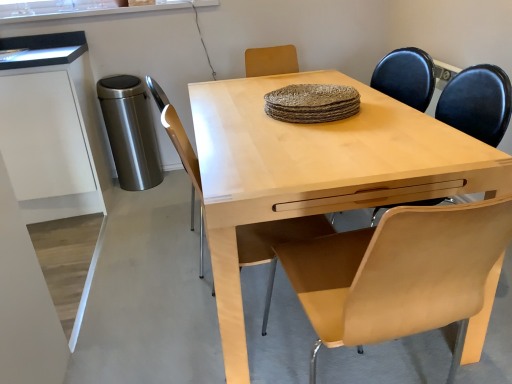
This screenshot has width=512, height=384. What do you see at coordinates (276, 236) in the screenshot? I see `light brown leather chair at center` at bounding box center [276, 236].

The image size is (512, 384). What do you see at coordinates (317, 171) in the screenshot?
I see `light wood desk at center` at bounding box center [317, 171].

Locate an element on the screen. This screenshot has height=384, width=512. light wood desk at center is located at coordinates (317, 171).

You are a GUI agent. You are given a task and a screenshot of the screen. Output one action in this format:
    pyautogui.click(x=<x>, y=<y>)
    Task: Click on the white matte cabinet at left
    The width and height of the screenshot is (512, 384).
    Given the screenshot: What is the action you would take?
    pyautogui.click(x=52, y=128)

Where is `light brown leather chair at center`? The width and height of the screenshot is (512, 384). light brown leather chair at center is located at coordinates (276, 236).

In the scene shown: What's the angular difference between light brown leather chair at center and light wood desk at center's facing directions?

There is a 180-degree angle between the facing directions of light brown leather chair at center and light wood desk at center.

In the scene shown: Between light brown leather chair at center and light wood desk at center, which one appears on the left side from the viewer's perspective?

Positioned to the left is light brown leather chair at center.

From the image's perspective, would you say light brown leather chair at center is shown under light wood desk at center?

Yes, from the image's perspective, light brown leather chair at center is beneath light wood desk at center.

Could light wood desk at center be considered to be inside light brown leather chair at center?

Actually, light wood desk at center is outside light brown leather chair at center.

Is light brown leather chair at center in front of or behind white matte cabinet at left in the image?

In the image, light brown leather chair at center appears in front of white matte cabinet at left.

In the scene shown: Between light brown leather chair at center and white matte cabinet at left, which one has larger width?

white matte cabinet at left.

Is point (267, 245) positioned in front of point (81, 40)?

Yes, it is in front of point (81, 40).

How different are the orientations of white matte cabinet at left and light brown leather chair at center in degrees?

There is a 89.2-degree angle between the facing directions of white matte cabinet at left and light brown leather chair at center.

Is white matte cabinet at left in front of or behind light brown leather chair at center in the image?

Visually, white matte cabinet at left is located behind light brown leather chair at center.

Is white matte cabinet at left with light brown leather chair at center?

No, white matte cabinet at left is not beside light brown leather chair at center.

At what (x,y) coordinates should I click in order to perform the action: click on cabinetry on the left of light brown leather chair at center. Please return your answer as a coordinate pair (x, y). Looking at the image, I should click on (52, 128).

Is light wood desk at center oriented away from light brown leather chair at center?

light wood desk at center is not turned away from light brown leather chair at center.

Considering the positions of objects light wood desk at center and light brown leather chair at center in the image provided, who is behind, light wood desk at center or light brown leather chair at center?

light brown leather chair at center is further away from the camera.

The image size is (512, 384). In order to click on chair on the left of light wood desk at center in this screenshot , I will do `click(276, 236)`.

Considering the positions of objects light wood desk at center and light brown leather chair at center in the image provided, who is more to the right, light wood desk at center or light brown leather chair at center?

From the viewer's perspective, light wood desk at center appears more on the right side.

Consider the image. Who is shorter, white matte cabinet at left or light wood desk at center?

light wood desk at center.

At what (x,y) coordinates should I click in order to perform the action: click on desk that is on the right side of white matte cabinet at left. Please return your answer as a coordinate pair (x, y). Image resolution: width=512 pixels, height=384 pixels. Looking at the image, I should click on (317, 171).

From a real-world perspective, is white matte cabinet at left over light wood desk at center?

Yes, from a real-world perspective, white matte cabinet at left is on top of light wood desk at center.

Considering the points (81, 212) and (267, 175), which point is behind, point (81, 212) or point (267, 175)?

Point (81, 212)

Consider the image. Who is shorter, light wood desk at center or white matte cabinet at left?

light wood desk at center.

Does light wood desk at center have a greater width compared to white matte cabinet at left?

Yes, light wood desk at center is wider than white matte cabinet at left.

Is light wood desk at center not near white matte cabinet at left?

Absolutely, light wood desk at center is distant from white matte cabinet at left.

How many degrees apart are the facing directions of light wood desk at center and white matte cabinet at left?

The angular difference between light wood desk at center and white matte cabinet at left is 90.8 degrees.

Find the location of a particular element. This screenshot has width=512, height=384. chair behind the light wood desk at center is located at coordinates (276, 236).

Locate an element on the screen. The width and height of the screenshot is (512, 384). cabinetry that appears above the light brown leather chair at center (from the image's perspective) is located at coordinates (52, 128).

When comparing their distances from light wood desk at center, does white matte cabinet at left or light brown leather chair at center seem closer?

The object closer to light wood desk at center is light brown leather chair at center.

From the image, which object appears to be nearer to white matte cabinet at left, light brown leather chair at center or light wood desk at center?

light wood desk at center.

Looking at this image, which object lies further to the anchor point white matte cabinet at left, light wood desk at center or light brown leather chair at center?

light brown leather chair at center is positioned further to the anchor white matte cabinet at left.

Looking at this image, considering their positions, is light brown leather chair at center positioned further to light wood desk at center than white matte cabinet at left?

Based on the image, white matte cabinet at left appears to be further to light wood desk at center.

Looking at the image, which one is located further to light brown leather chair at center, white matte cabinet at left or light wood desk at center?

Based on the image, white matte cabinet at left appears to be further to light brown leather chair at center.

When comparing their distances from light brown leather chair at center, does light wood desk at center or white matte cabinet at left seem closer?

The object closer to light brown leather chair at center is light wood desk at center.

Find the location of a particular element. The image size is (512, 384). chair between white matte cabinet at left and light wood desk at center in the horizontal direction is located at coordinates (276, 236).